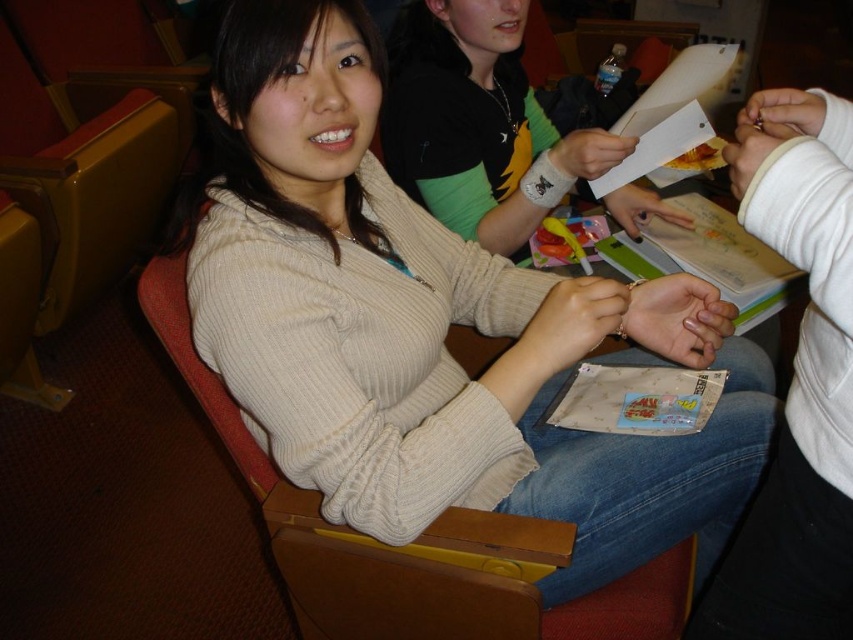
Question: Is beige knit sweater at center behind white sweater at center?

Choices:
 (A) no
 (B) yes

Answer: (B)

Question: Which point is closer to the camera?

Choices:
 (A) (543, 465)
 (B) (821, 268)

Answer: (B)

Question: Observing the image, what is the correct spatial positioning of beige knit sweater at center in reference to white sweater at center?

Choices:
 (A) above
 (B) below

Answer: (A)

Question: Among these points, which one is nearest to the camera?

Choices:
 (A) (751, 544)
 (B) (679, 483)

Answer: (A)

Question: Which point appears closest to the camera in this image?

Choices:
 (A) (433, 412)
 (B) (833, 496)

Answer: (B)

Question: Does beige knit sweater at center lie in front of white sweater at center?

Choices:
 (A) no
 (B) yes

Answer: (A)